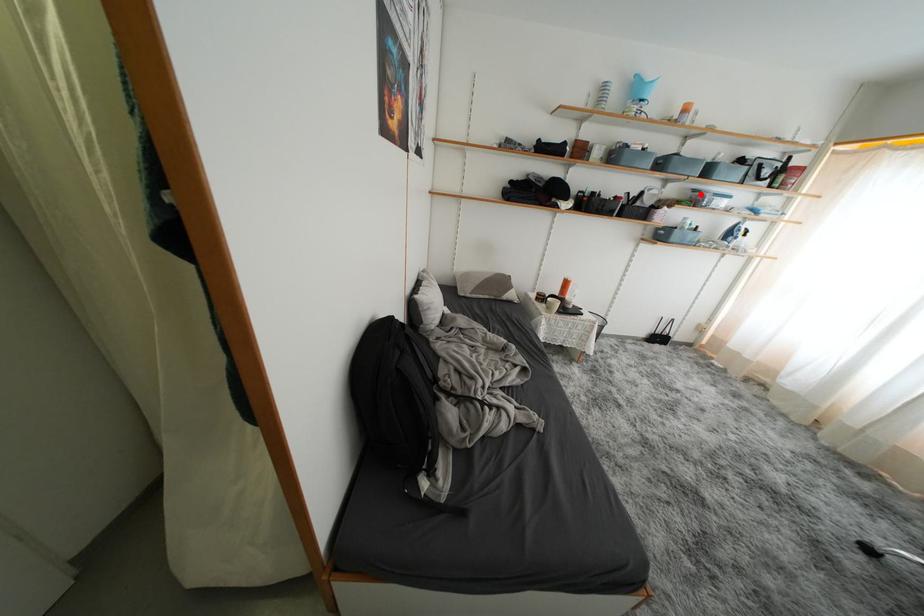
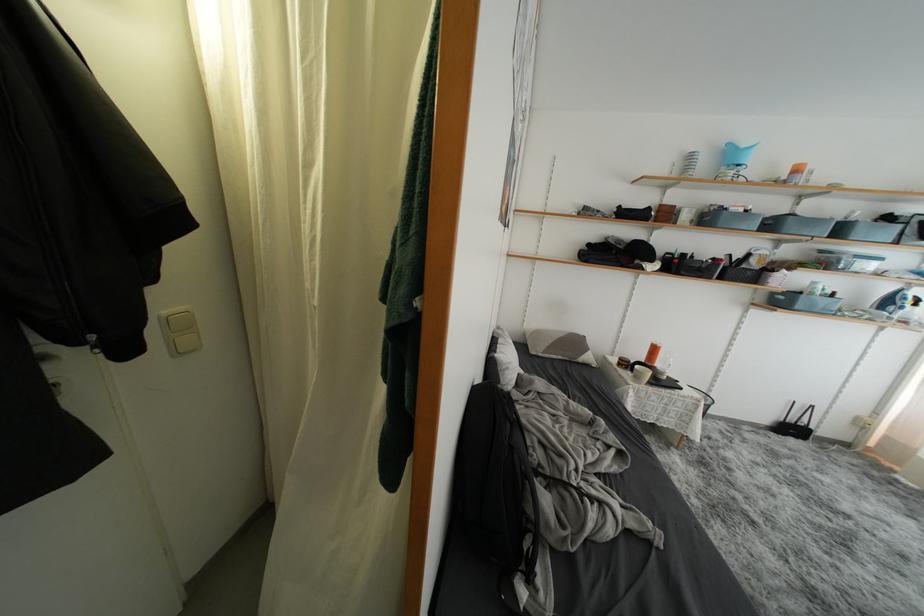
Question: I am providing you with two images of the same scene from different viewpoints. Image1 has a red point marked. In image2, the corresponding 3D location appears at what relative position? Reply with the corresponding letter.

Choices:
 (A) Closer
 (B) Farther

Answer: (B)